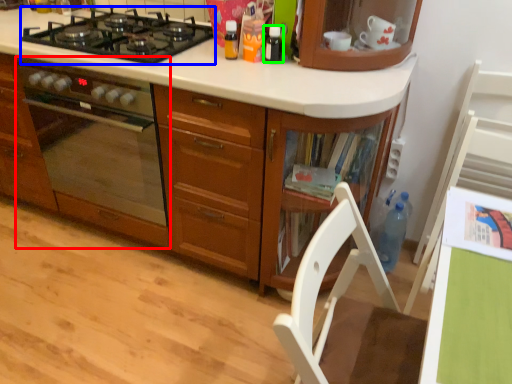
Question: Based on their relative distances, which object is nearer to home appliance (highlighted by a red box)? Choose from gas stove (highlighted by a blue box) and kitchen appliance (highlighted by a green box).

Choices:
 (A) gas stove
 (B) kitchen appliance

Answer: (A)